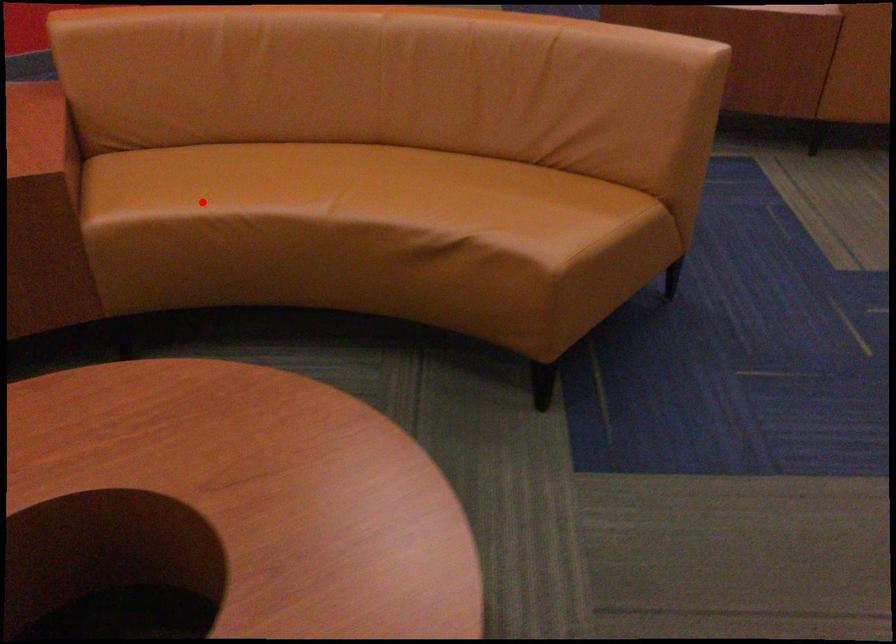
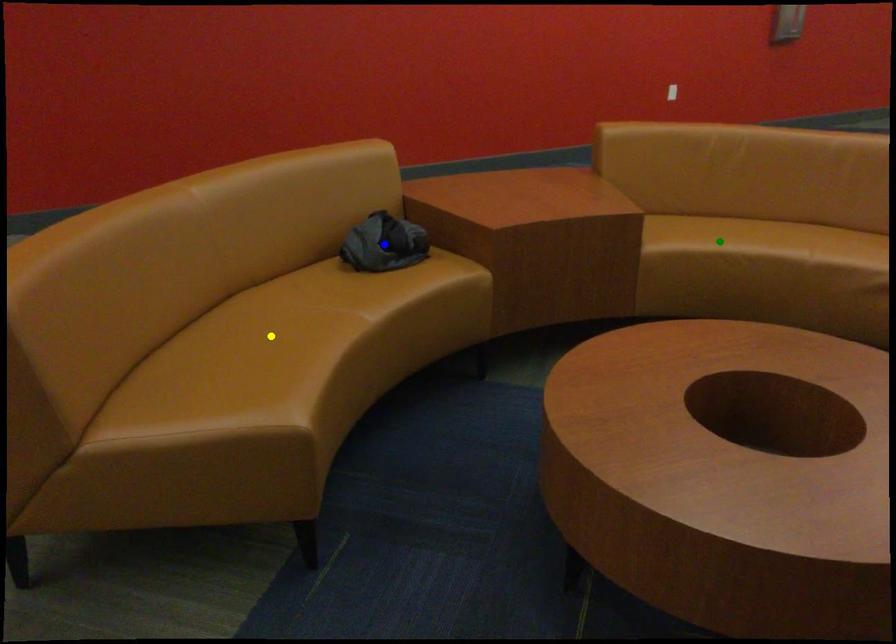
Question: I am providing you with two images of the same scene from different viewpoints. A red point is marked on the first image. You are given multiple points on the second image. In image 2, which mark is for the same physical point as the one in image 1?

Choices:
 (A) blue point
 (B) yellow point
 (C) green point

Answer: (C)